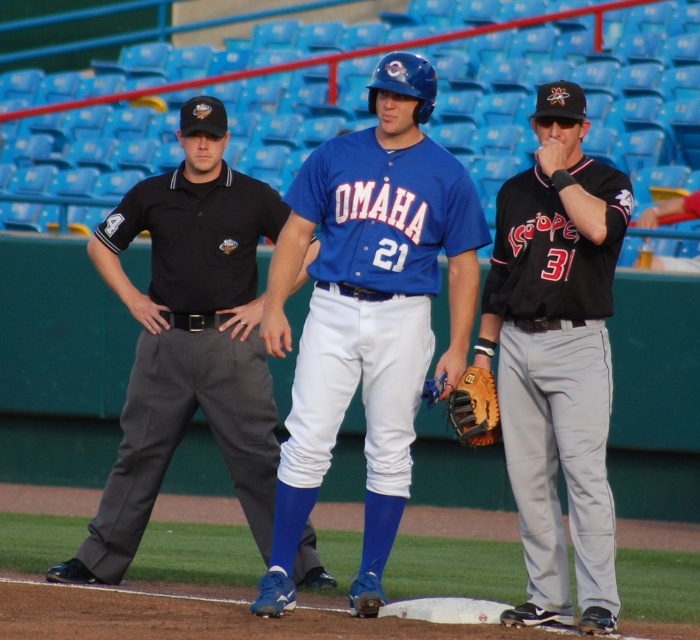
Question: Based on their relative distances, which object is nearer to the black jersey at center?

Choices:
 (A) blue matte baseball uniform at center
 (B) brown leather baseball glove at center

Answer: (B)

Question: Is black smooth shirt at center bigger than black jersey at center?

Choices:
 (A) yes
 (B) no

Answer: (A)

Question: Which of these objects is positioned closest to the black jersey at center?

Choices:
 (A) black smooth shirt at center
 (B) brown leather baseball glove at center
 (C) blue matte baseball uniform at center

Answer: (B)

Question: Which of the following is the closest to the observer?

Choices:
 (A) (150, 195)
 (B) (480, 385)

Answer: (B)

Question: Is black jersey at center wider than brown leather baseball glove at center?

Choices:
 (A) no
 (B) yes

Answer: (B)

Question: Is blue matte baseball uniform at center thinner than black smooth shirt at center?

Choices:
 (A) no
 (B) yes

Answer: (B)